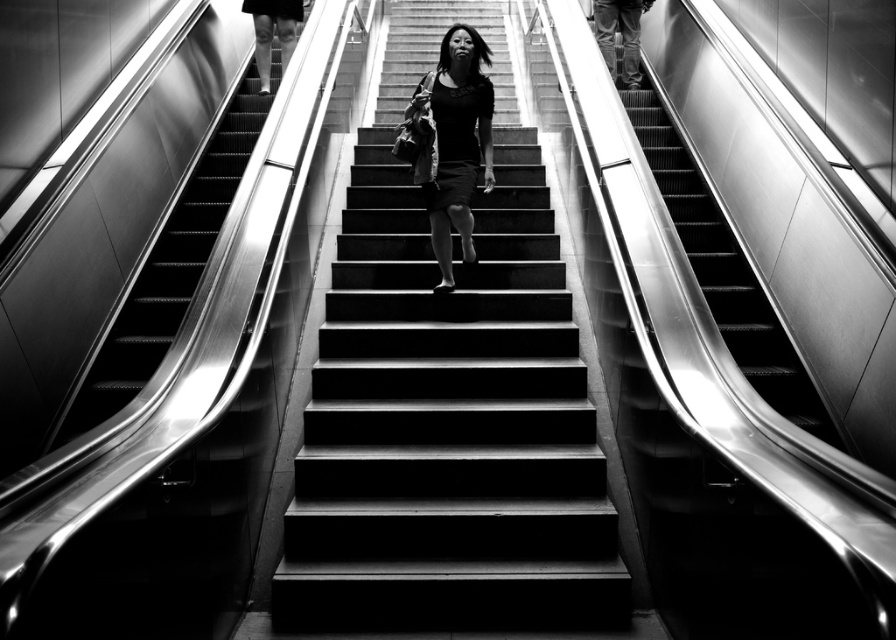
Which is more to the right, smooth concrete stairs at center or metallic silver stairs at right?

metallic silver stairs at right is more to the right.

I want to click on smooth concrete stairs at center, so click(x=448, y=410).

You are a GUI agent. You are given a task and a screenshot of the screen. Output one action in this format:
    pyautogui.click(x=<x>, y=<y>)
    Task: Click on the metallic escalator at left
    The image size is (896, 640).
    Given the screenshot: What is the action you would take?
    pyautogui.click(x=169, y=268)

Is smooth concrete stairs at center taller than black matte dress at center?

No.

Between smooth concrete stairs at center and black matte dress at center, which one appears on the left side from the viewer's perspective?

smooth concrete stairs at center is more to the left.

Who is more distant from viewer, (496, 632) or (481, 124)?

Positioned behind is point (481, 124).

Find the location of a particular element. This screenshot has height=640, width=896. smooth concrete stairs at center is located at coordinates (448, 410).